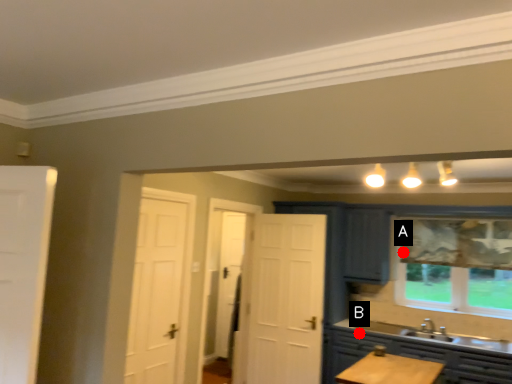
Question: Two points are circled on the image, labeled by A and B beside each circle. Which point is farther to the camera?

Choices:
 (A) A is further
 (B) B is further

Answer: (A)